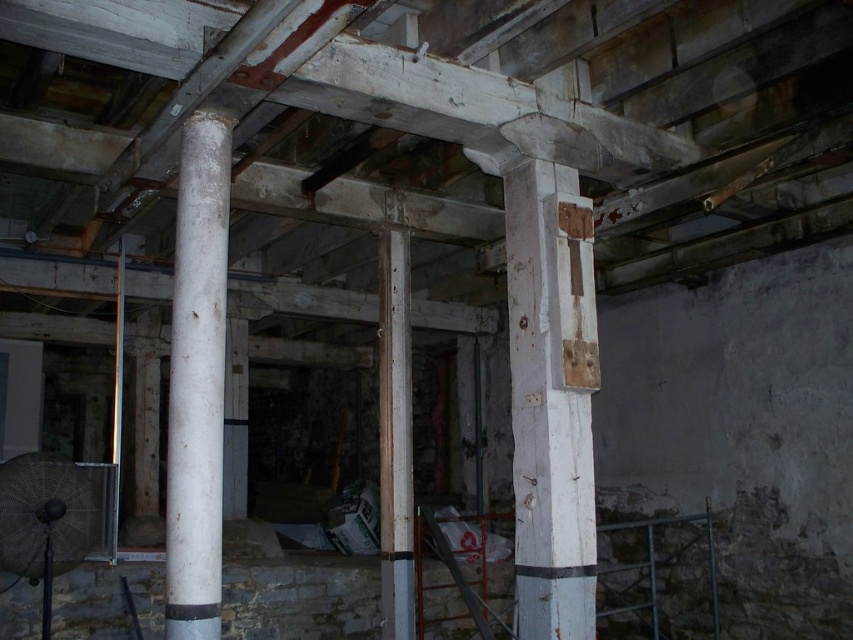
Question: Is white wood pillar at center thinner than rusty metal pole at center?

Choices:
 (A) no
 (B) yes

Answer: (A)

Question: Which of the following is the closest to the observer?

Choices:
 (A) (381, 451)
 (B) (165, 630)
 (C) (527, 472)

Answer: (B)

Question: Which of the following is the closest to the observer?

Choices:
 (A) rusty metal pole at center
 (B) white matte column at center
 (C) white wood pillar at center

Answer: (B)

Question: Considering the real-world distances, which object is closest to the rusty metal pole at center?

Choices:
 (A) white wood pillar at center
 (B) white matte column at center

Answer: (A)

Question: Is white matte column at center to the left of rusty metal pole at center from the viewer's perspective?

Choices:
 (A) no
 (B) yes

Answer: (B)

Question: Does white matte column at center have a larger size compared to rusty metal pole at center?

Choices:
 (A) yes
 (B) no

Answer: (B)